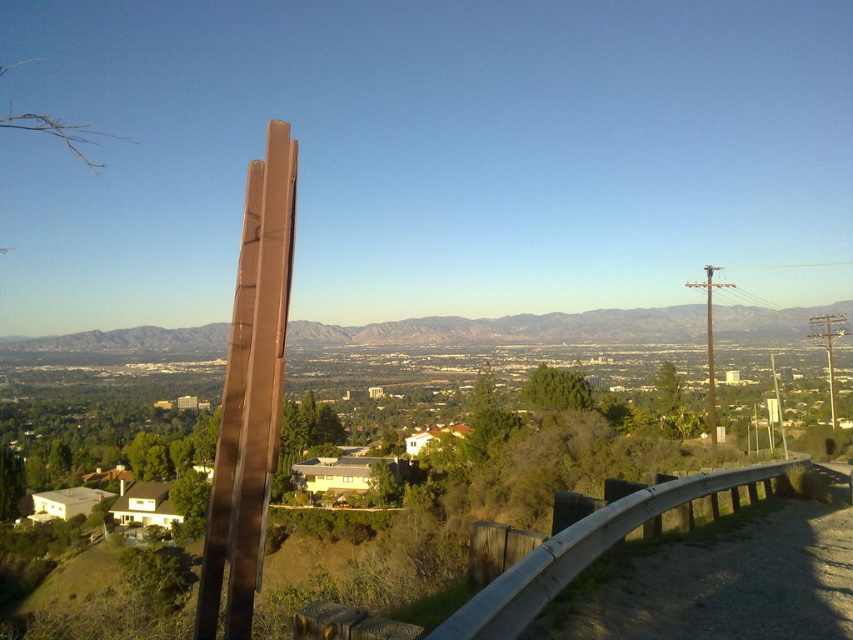
You are an architect designing a new outdoor sculpture garden. You want to place a new sculpture that is exactly the same size as the brown polished wood at center next to the brown matte mountain at center. Will the new sculpture fit in the space between them without overlapping?

The brown polished wood at center is smaller than the brown matte mountain at center. Since the new sculpture will be the same size as the brown polished wood at center, it will fit in the space between them without overlapping as long as there is enough space between the two existing objects.

You are standing at the edge of a scenic overlook and want to take a photo of the brown polished wood at center. If your camera has a focal length of 50mm and you want to capture the entire sculpture in the frame, will you need to move closer or farther away?

The brown polished wood at center and viewer are 3.49 meters apart. To capture the entire sculpture in the frame with a 50mm focal length, you would need to move farther away since the current distance might be too close for the camera to focus on the entire sculpture.

You are standing at the vantage point looking at the landscape. There are two points marked in the image, point [294,196] and point [648,330]. Which point is nearer to you?

Point [294,196] is closer to the viewer than point [648,330].